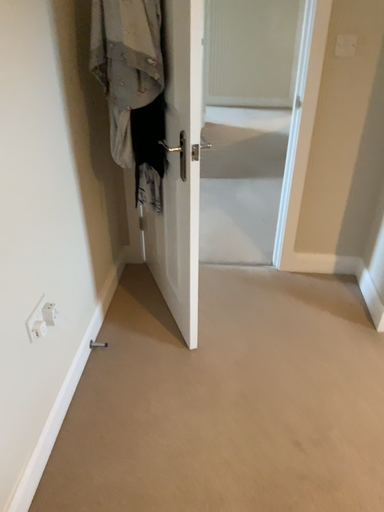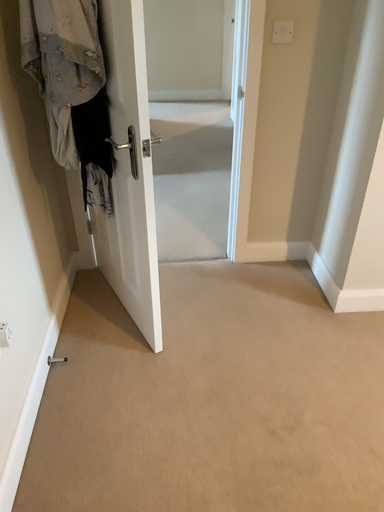
Question: Which way did the camera rotate in the video?

Choices:
 (A) rotated left
 (B) rotated right

Answer: (B)